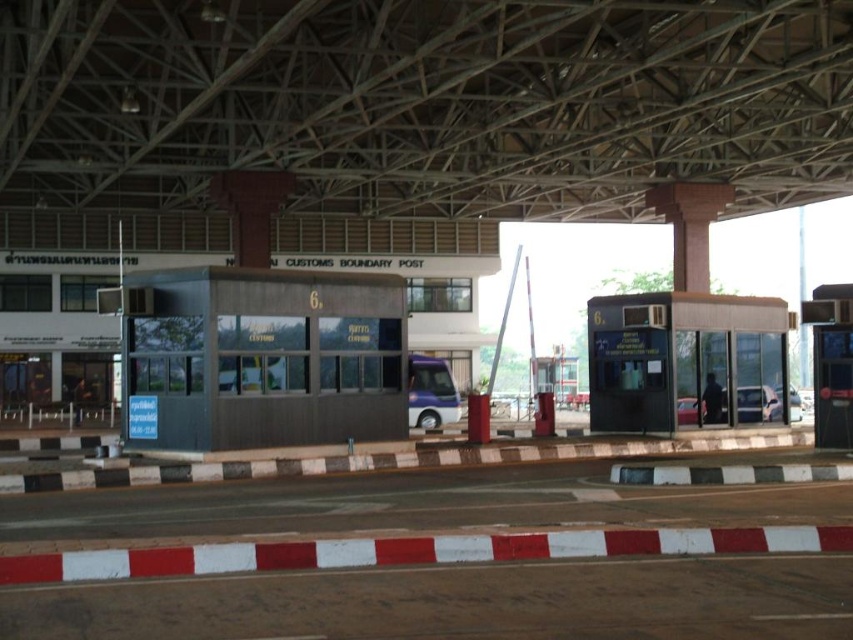
You are a pedestrian approaching the customs boundary post. You see the matte black booth at right and the metallic purple bus at center. Which object is closer to the ground?

The matte black booth at right is closer to the ground because it is below the metallic purple bus at center.

You are a customs officer assigned to the metallic gray booth at center. Your supervisor asks you to move to the booth located at coordinates point 0.478, 0.067. Do you need to move your booth?

The metallic gray booth at center is already located at point [56,305], so you do not need to move it.